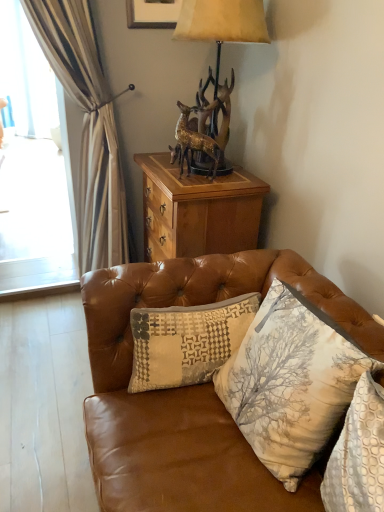
Locate an element on the screen. Image resolution: width=384 pixels, height=512 pixels. free space in front of gold metallic deer at center is located at coordinates (195, 185).